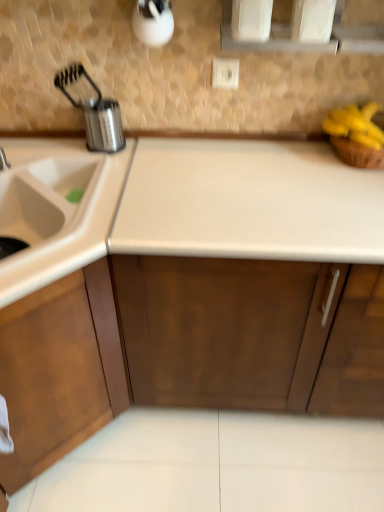
Identify the location of vacant area located to the right-hand side of brushed metal faucet at left. Image resolution: width=384 pixels, height=512 pixels. (56, 164).